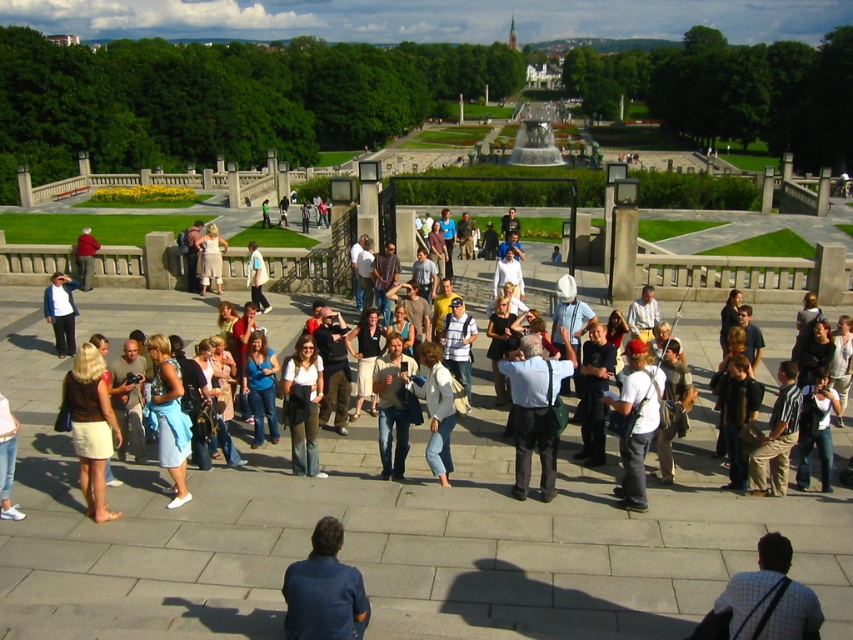
Question: Can you confirm if matte black top at center is positioned above light beige dress at center?

Choices:
 (A) no
 (B) yes

Answer: (A)

Question: Which point is closer to the camera?

Choices:
 (A) dark blue shirt at lower center
 (B) grid-patterned shirt at lower right

Answer: (B)

Question: Among these points, which one is nearest to the camera?

Choices:
 (A) (254, 266)
 (B) (209, 243)

Answer: (A)

Question: Can you confirm if dark blue shirt at lower center is thinner than light blue shirt at center?

Choices:
 (A) no
 (B) yes

Answer: (B)

Question: Is light brown leather jacket at center to the right of blue denim jeans at center from the viewer's perspective?

Choices:
 (A) yes
 (B) no

Answer: (A)

Question: Considering the real-world distances, which object is closest to the light blue denim jeans at center?

Choices:
 (A) light blue denim skirt at center
 (B) dark blue shirt at lower center
 (C) brown leather skirt at center
 (D) matte black top at center

Answer: (D)